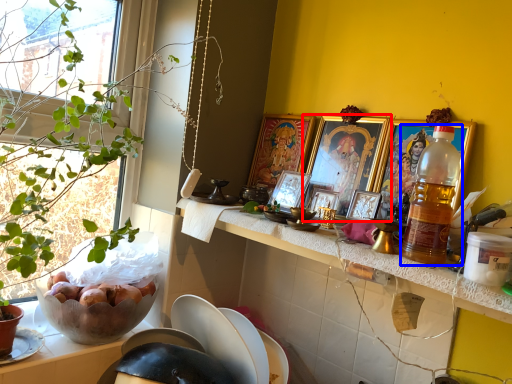
Question: Which point is closer to the camera, picture frame (highlighted by a red box) or bottle (highlighted by a blue box)?

Choices:
 (A) picture frame
 (B) bottle

Answer: (B)